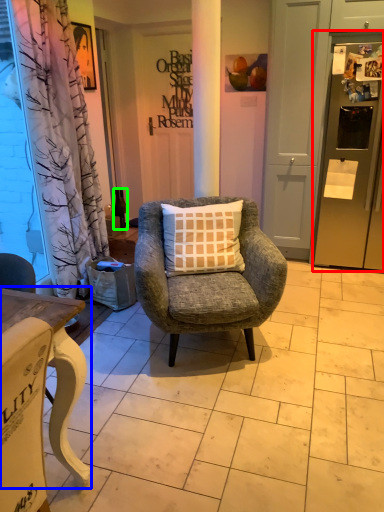
Question: Which object is the farthest from refrigerator (highlighted by a red box)? Choose among these: desk (highlighted by a blue box) or bottle (highlighted by a green box).

Choices:
 (A) desk
 (B) bottle

Answer: (A)